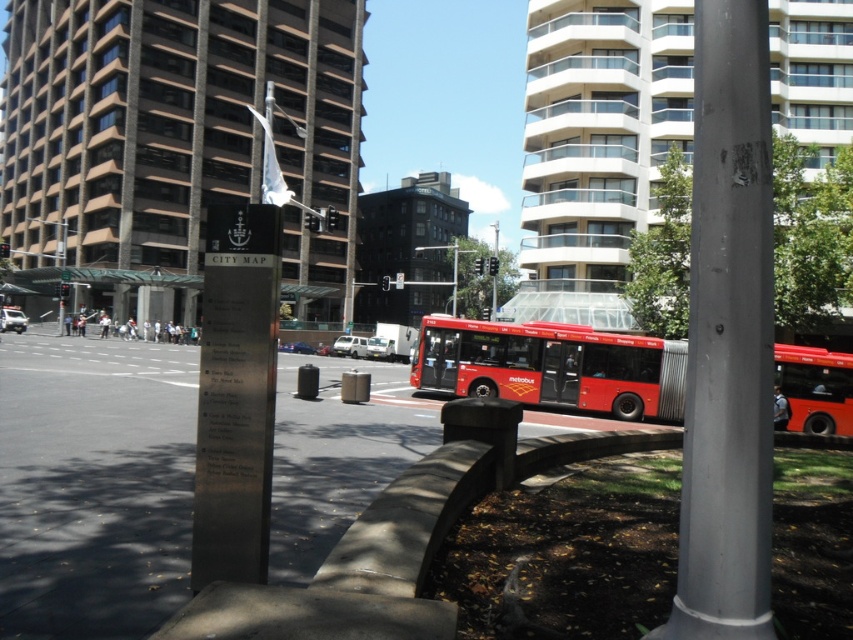
You are a pedestrian standing at the edge of the street and see the gray metallic pole at center and the metallic red bus at center. Which object is nearer to you?

The gray metallic pole at center is closer to the viewer than the metallic red bus at center, so the gray metallic pole at center is nearer to you.

You are standing at the origin point of the coordinate system. You need to locate the gray metallic pole at center. What are the exact coordinates where you should look to find it?

The gray metallic pole at center is located at the coordinates point (727, 337).